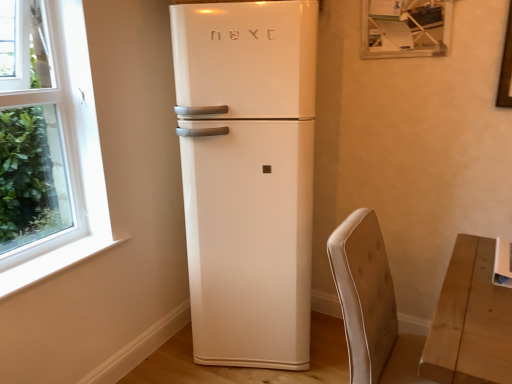
Question: Can we say velvet beige armchair at lower right lies outside white glossy refrigerator at center?

Choices:
 (A) no
 (B) yes

Answer: (B)

Question: Could white glossy refrigerator at center be considered to be inside velvet beige armchair at lower right?

Choices:
 (A) no
 (B) yes

Answer: (A)

Question: Does velvet beige armchair at lower right have a lesser height compared to white glossy refrigerator at center?

Choices:
 (A) no
 (B) yes

Answer: (B)

Question: From a real-world perspective, is velvet beige armchair at lower right on top of white glossy refrigerator at center?

Choices:
 (A) yes
 (B) no

Answer: (B)

Question: From the image's perspective, is velvet beige armchair at lower right below white glossy refrigerator at center?

Choices:
 (A) yes
 (B) no

Answer: (A)

Question: Can you confirm if velvet beige armchair at lower right is bigger than white glossy refrigerator at center?

Choices:
 (A) yes
 (B) no

Answer: (B)

Question: Does white glossy refrigerator at center touch velvet beige armchair at lower right?

Choices:
 (A) yes
 (B) no

Answer: (B)

Question: Can velvet beige armchair at lower right be found inside white glossy refrigerator at center?

Choices:
 (A) yes
 (B) no

Answer: (B)

Question: Is white glossy refrigerator at center oriented away from velvet beige armchair at lower right?

Choices:
 (A) no
 (B) yes

Answer: (A)

Question: Can you confirm if white glossy refrigerator at center is thinner than velvet beige armchair at lower right?

Choices:
 (A) no
 (B) yes

Answer: (A)

Question: From a real-world perspective, does white glossy refrigerator at center sit lower than velvet beige armchair at lower right?

Choices:
 (A) no
 (B) yes

Answer: (A)

Question: Is white glossy refrigerator at center facing towards velvet beige armchair at lower right?

Choices:
 (A) no
 (B) yes

Answer: (A)

Question: Considering the positions of velvet beige armchair at lower right and white glossy refrigerator at center in the image, is velvet beige armchair at lower right wider or thinner than white glossy refrigerator at center?

Choices:
 (A) thin
 (B) wide

Answer: (A)